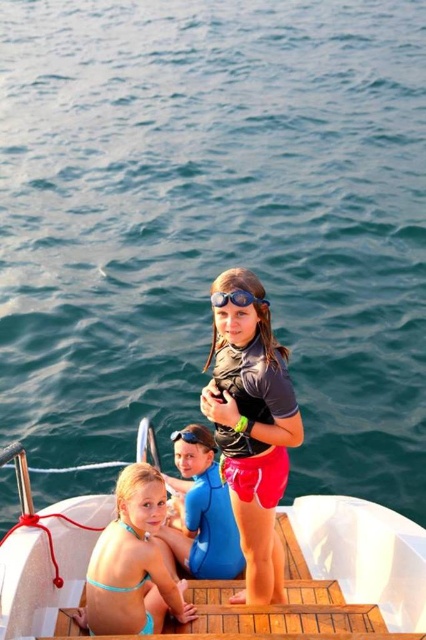
Question: Which object appears closest to the camera in this image?

Choices:
 (A) matte black wetsuit at center
 (B) light blue bikini at lower left
 (C) blue neoprene wetsuit at center
 (D) transparent blue goggles at upper center

Answer: (B)

Question: Which of the following is the closest to the observer?

Choices:
 (A) blue rubber goggles at center
 (B) transparent blue goggles at upper center
 (C) matte black wetsuit at center

Answer: (C)

Question: Is light blue bikini at lower left wider than wooden at center?

Choices:
 (A) no
 (B) yes

Answer: (A)

Question: Which of these objects is positioned farthest from the white plastic boat at center?

Choices:
 (A) blue neoprene wetsuit at center
 (B) blue rubber goggles at center
 (C) wooden at center

Answer: (B)

Question: Can you confirm if blue rubber goggles at center is smaller than transparent blue goggles at upper center?

Choices:
 (A) yes
 (B) no

Answer: (B)

Question: Can you confirm if white plastic boat at center is positioned below matte black wetsuit at center?

Choices:
 (A) yes
 (B) no

Answer: (A)